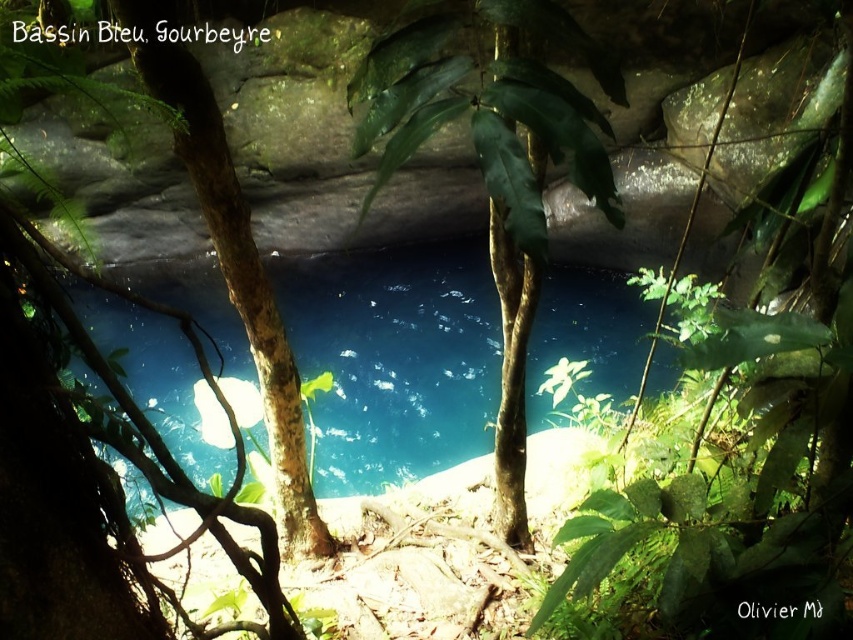
Who is lower down, green rough bark tree at center or brown rough tree trunk at center?

Positioned lower is brown rough tree trunk at center.

Locate an element on the screen. green rough bark tree at center is located at coordinates (497, 168).

At what (x,y) coordinates should I click in order to perform the action: click on green rough bark tree at center. Please return your answer as a coordinate pair (x, y). The height and width of the screenshot is (640, 853). Looking at the image, I should click on (497, 168).

Between point (618, 284) and point (598, 147), which one is positioned in front?

Positioned in front is point (598, 147).

In the scene shown: Does transparent blue water at center have a greater height compared to green rough bark tree at center?

Yes.

Between point (440, 337) and point (427, 20), which one is positioned in front?

Positioned in front is point (427, 20).

Where is `transparent blue water at center`? transparent blue water at center is located at coordinates (397, 362).

Does transparent blue water at center appear on the right side of brown rough tree trunk at center?

Yes, transparent blue water at center is to the right of brown rough tree trunk at center.

Does point (547, 349) come farther from viewer compared to point (97, 547)?

Yes.

Is point (184, 378) positioned in front of point (86, 506)?

No, (184, 378) is behind (86, 506).

Locate an element on the screen. This screenshot has width=853, height=640. transparent blue water at center is located at coordinates (397, 362).